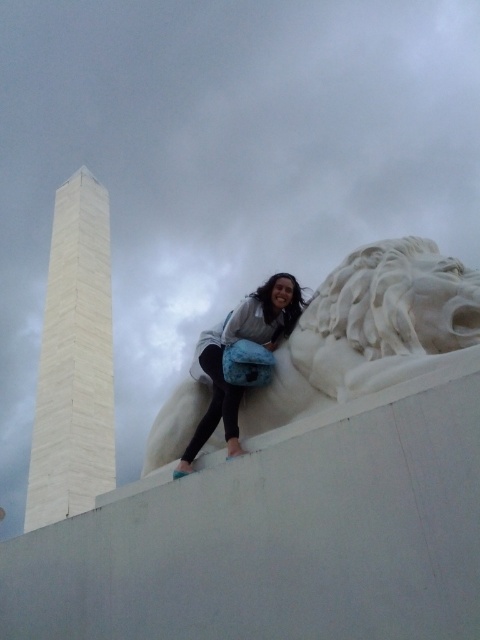
Does white marble lion head at upper center have a lesser width compared to matte white statue at upper center?

No, white marble lion head at upper center is not thinner than matte white statue at upper center.

Is white marble lion head at upper center further to camera compared to matte white statue at upper center?

That is False.

Between point (323, 406) and point (199, 349), which one is positioned behind?

Positioned behind is point (199, 349).

You are a GUI agent. You are given a task and a screenshot of the screen. Output one action in this format:
    pyautogui.click(x=<x>, y=<y>)
    Task: Click on the white marble lion head at upper center
    
    Given the screenshot: What is the action you would take?
    pyautogui.click(x=370, y=332)